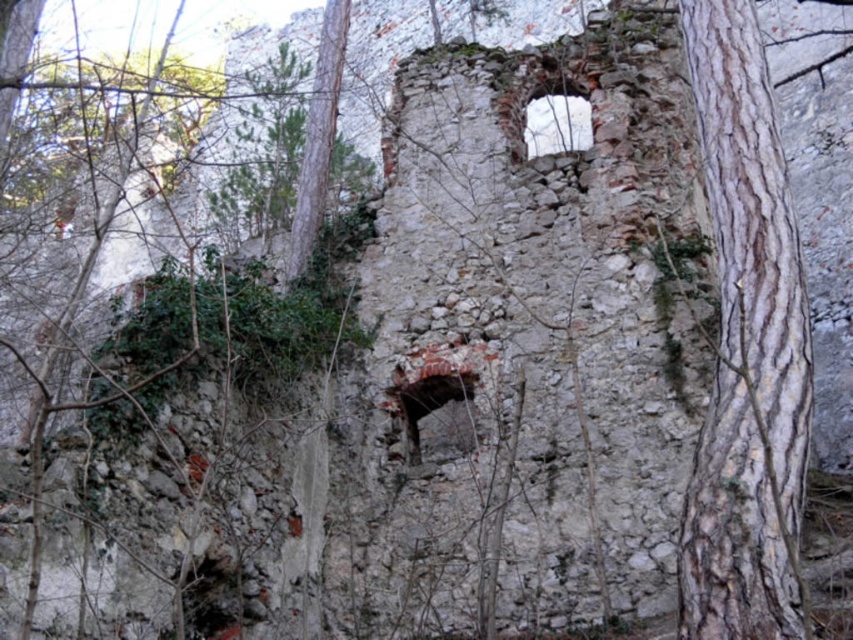
Question: Which is nearer to the white stone hole at upper center?

Choices:
 (A) smooth bark tree trunk at right
 (B) cracked stone hole at lower left
 (C) smooth brown bark at center

Answer: (C)

Question: Among these points, which one is nearest to the camera?

Choices:
 (A) (437, 417)
 (B) (728, 624)
 (C) (564, 141)
 (D) (225, 582)

Answer: (B)

Question: Can you confirm if smooth bark tree trunk at right is positioned above cracked stone hole at lower left?

Choices:
 (A) no
 (B) yes

Answer: (B)

Question: Can you confirm if smooth bark tree trunk at right is positioned to the right of cracked stone hole at lower left?

Choices:
 (A) no
 (B) yes

Answer: (B)

Question: Which of the following is the closest to the observer?

Choices:
 (A) smooth bark tree trunk at right
 (B) cracked stone hole at lower left
 (C) dark brown stone hole at center

Answer: (A)

Question: Is dark brown stone hole at center below cracked stone hole at lower left?

Choices:
 (A) no
 (B) yes

Answer: (A)